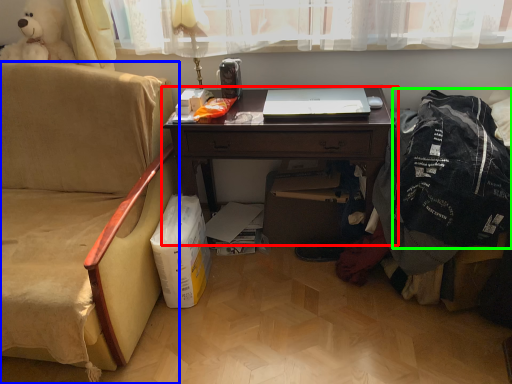
Question: Based on their relative distances, which object is farther from desk (highlighted by a red box)? Choose from chair (highlighted by a blue box) and clothing (highlighted by a green box).

Choices:
 (A) chair
 (B) clothing

Answer: (A)